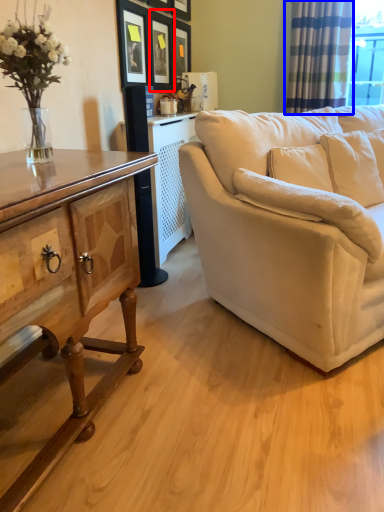
Question: Which of the following is the closest to the observer, picture frame (highlighted by a red box) or curtain (highlighted by a blue box)?

Choices:
 (A) picture frame
 (B) curtain

Answer: (A)